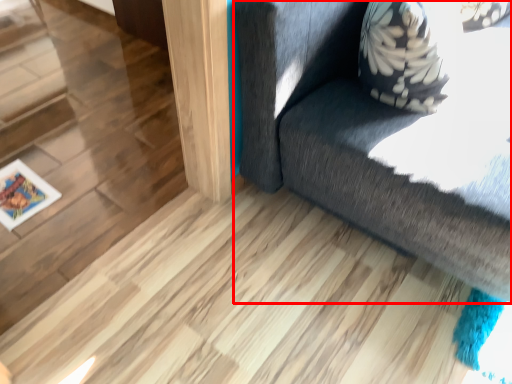
Question: From the image's perspective, where is furniture (annotated by the red box) located relative to picture frame?

Choices:
 (A) below
 (B) above

Answer: (B)